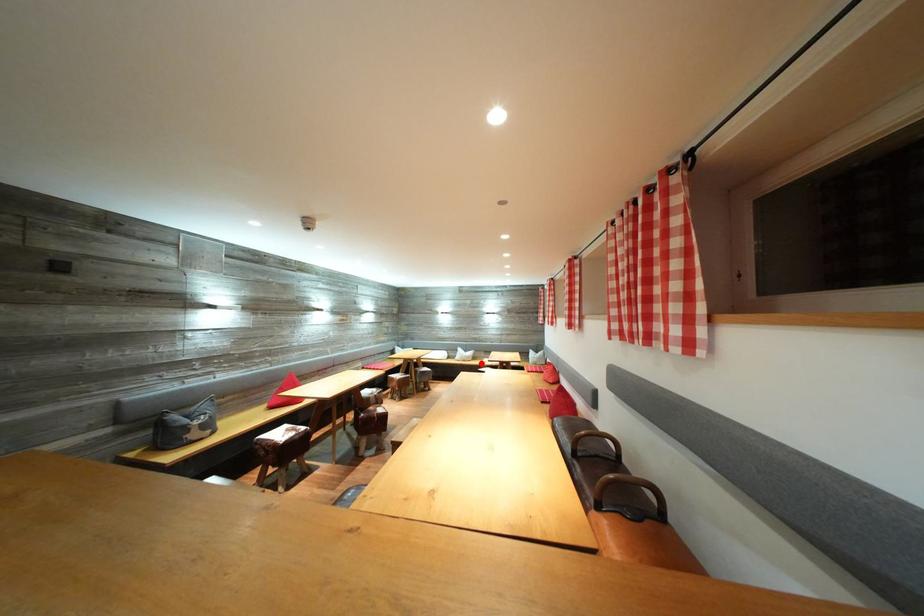
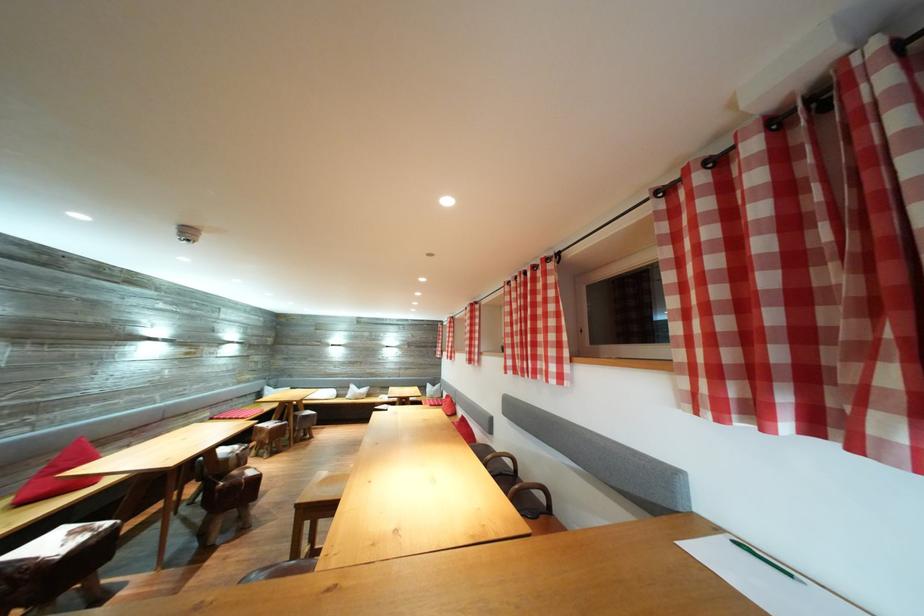
Question: A red point is marked in image1. In image2, is the corresponding 3D point closer to the camera or farther? Reply with the corresponding letter.

Choices:
 (A) The corresponding 3D point is closer.
 (B) The corresponding 3D point is farther.

Answer: (B)